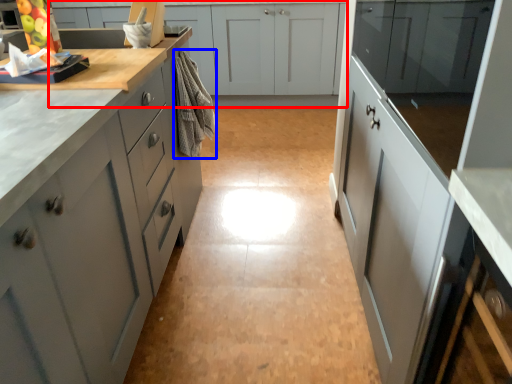
Question: Which of the following is the farthest to the observer, cabinetry (highlighted by a red box) or material (highlighted by a blue box)?

Choices:
 (A) cabinetry
 (B) material

Answer: (A)